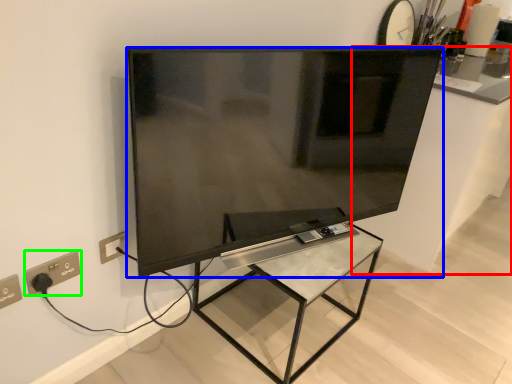
Question: Which object is positioned closest to counter top (highlighted by a red box)? Select from television (highlighted by a blue box) and power plugs and sockets (highlighted by a green box).

Choices:
 (A) television
 (B) power plugs and sockets

Answer: (A)